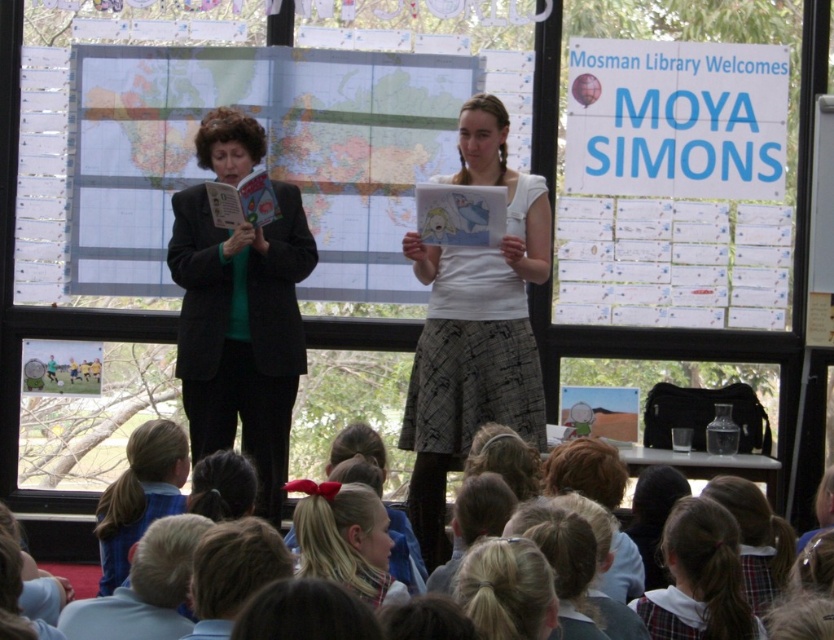
You are a photographer at the library event. You want to capture a photo of the black fabric jacket at left and the plaid hairband at center. Which object should you focus on first to ensure both are in the frame?

The plaid hairband at center is behind the black fabric jacket at left, so you should focus on the black fabric jacket at left first to ensure both are in the frame.